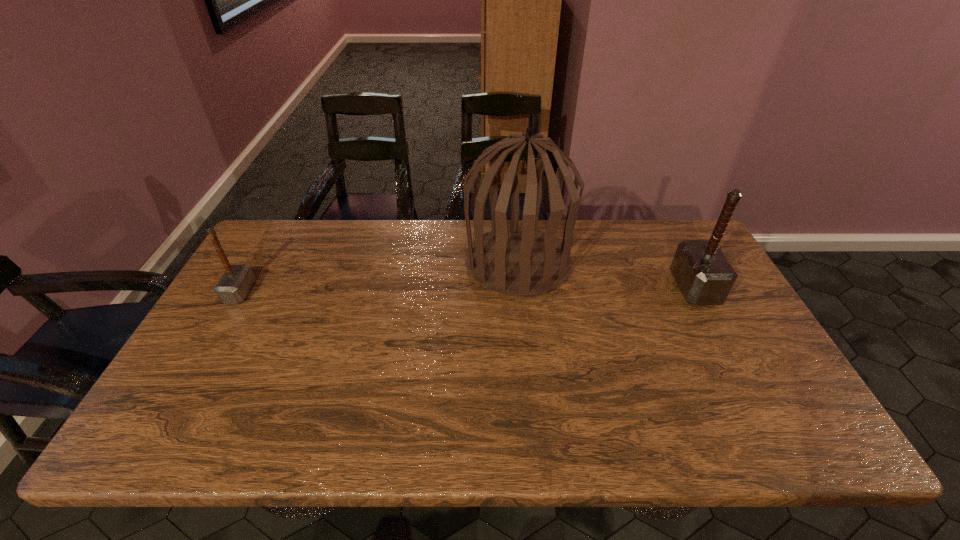
Where is `object at the left edge`? The height and width of the screenshot is (540, 960). object at the left edge is located at coordinates (233, 287).

Find the location of `object present at the right edge`. object present at the right edge is located at coordinates (704, 275).

In the image, there is a desktop. Identify the location of vacant region at the far edge. The width and height of the screenshot is (960, 540). (444, 239).

The width and height of the screenshot is (960, 540). Find the location of `vacant space at the near edge`. vacant space at the near edge is located at coordinates (675, 421).

The width and height of the screenshot is (960, 540). I want to click on free space at the left edge of the desktop, so click(180, 390).

You are a GUI agent. You are given a task and a screenshot of the screen. Output one action in this format:
    pyautogui.click(x=<x>, y=<y>)
    Task: Click on the free space at the right edge of the desktop
    The width and height of the screenshot is (960, 540).
    Given the screenshot: What is the action you would take?
    pyautogui.click(x=702, y=320)

You are a GUI agent. You are given a task and a screenshot of the screen. Output one action in this format:
    pyautogui.click(x=<x>, y=<y>)
    Task: Click on the free space at the far left corner of the desktop
    
    Given the screenshot: What is the action you would take?
    pyautogui.click(x=273, y=225)

In the image, there is a desktop. Where is `blank space at the near left corner`? The height and width of the screenshot is (540, 960). blank space at the near left corner is located at coordinates coord(178,444).

The width and height of the screenshot is (960, 540). Identify the location of vacant region at the near right corner of the desktop. (755, 435).

This screenshot has width=960, height=540. Find the location of `free spot between the left hammer and the second object from right to left`. free spot between the left hammer and the second object from right to left is located at coordinates (379, 278).